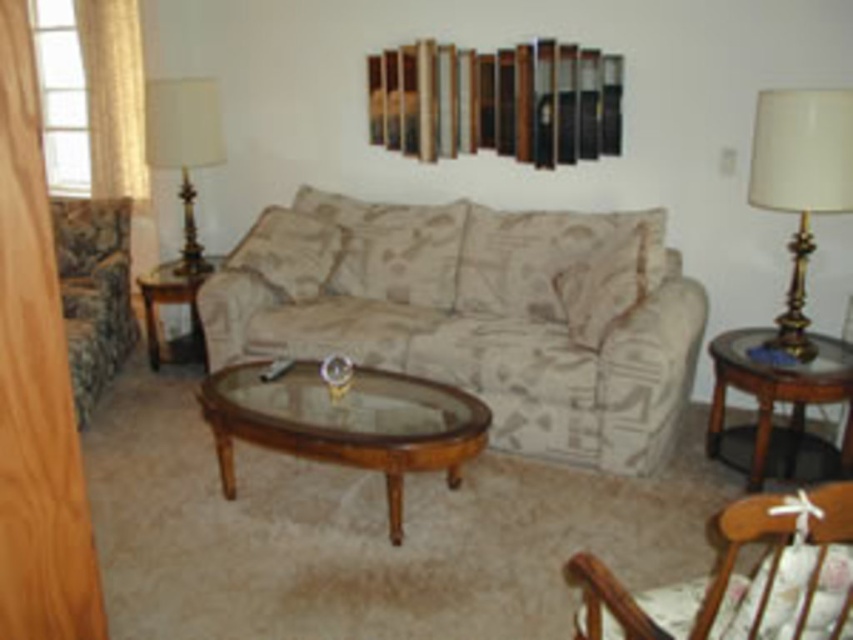
You are planning to place a new rectangular rug in the living room. The rug must fit between the camouflage fabric couch at left and the brown wood side table at left. Given that the rug is 1.2 meters wide, will it fit if placed horizontally between them?

The camouflage fabric couch at left is narrower than the brown wood side table at left. However, the exact dimensions needed to determine if the rug will fit are not provided in the scene description. Without knowing the distance between them or the specific widths, it is impossible to confirm if the 1.2 meter wide rug will fit horizontally between them.

You are standing in the living room and want to place a small plant between the two points, point (x=210, y=403) and point (x=848, y=458). Based on their positions, where should the plant be placed to be between them?

The plant should be placed between point (x=210, y=403) and point (x=848, y=458), closer to point (x=210, y=403) since it is in front of point (x=848, y=458).